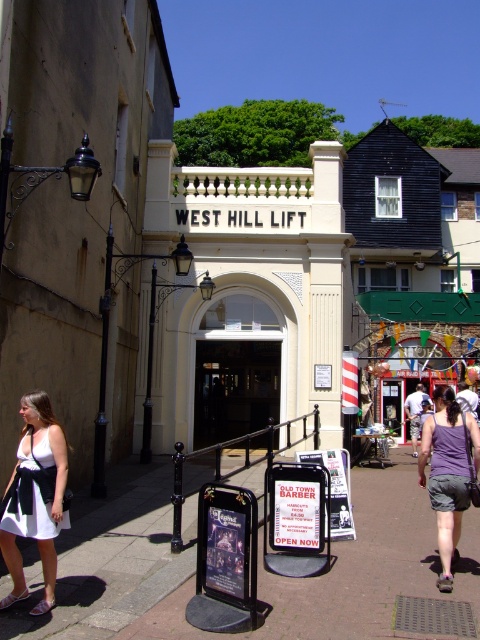
Question: Among these objects, which one is farthest from the camera?

Choices:
 (A) white plastic sign at center
 (B) white matte dress at lower left
 (C) transparent glass door at center

Answer: (C)

Question: Is the position of brown stone pavement at center less distant than that of white plastic sign at center?

Choices:
 (A) yes
 (B) no

Answer: (A)

Question: Can you confirm if white matte dress at lower left is smaller than purple fabric shorts at lower right?

Choices:
 (A) yes
 (B) no

Answer: (A)

Question: Which of these objects is positioned closest to the white matte dress at lower left?

Choices:
 (A) purple fabric shorts at lower right
 (B) white plastic sign at center

Answer: (B)

Question: Which point is closer to the camera?

Choices:
 (A) (228, 371)
 (B) (36, 406)
 (C) (300, 484)

Answer: (B)

Question: Does transparent glass door at center have a larger size compared to purple fabric shorts at lower right?

Choices:
 (A) no
 (B) yes

Answer: (A)